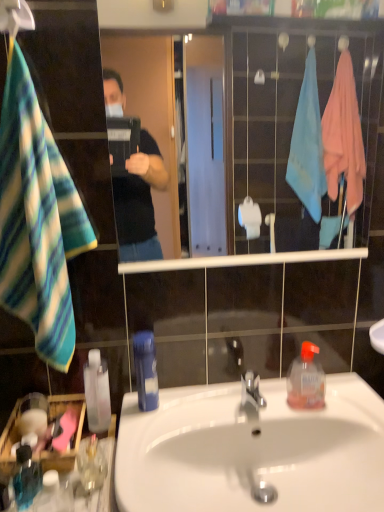
Question: Is translucent glass mug at lower left wider or thinner than translucent plastic hand sanitizer at lower right, the 5th bottle from the left?

Choices:
 (A) wide
 (B) thin

Answer: (B)

Question: Considering the positions of translucent glass mug at lower left and translucent plastic hand sanitizer at lower right, the 5th bottle from the left, in the image, is translucent glass mug at lower left taller or shorter than translucent plastic hand sanitizer at lower right, the 5th bottle from the left,?

Choices:
 (A) short
 (B) tall

Answer: (A)

Question: Based on their relative distances, which object is nearer to the white glossy sink at center?

Choices:
 (A) transparent plastic bottle at lower left, which is the 3th bottle from left to right
 (B) translucent blue liquid at lower left, the first bottle from the left
 (C) blue plastic bottle at sink, the 2th bottle when ordered from right to left
 (D) translucent plastic hand sanitizer at lower right, marked as the first bottle in a right-to-left arrangement
 (E) clear glass mirror at center

Answer: (D)

Question: Based on their relative distances, which object is nearer to the striped fleece towel at left?

Choices:
 (A) translucent blue liquid at lower left, the 5th bottle in the right-to-left sequence
 (B) blue plastic bottle at sink, the 2th bottle when ordered from right to left
 (C) translucent plastic bottle at lower left, which is the 2th bottle in left-to-right order
 (D) white glossy sink at center
 (E) metallic silver hanger at upper left

Answer: (B)